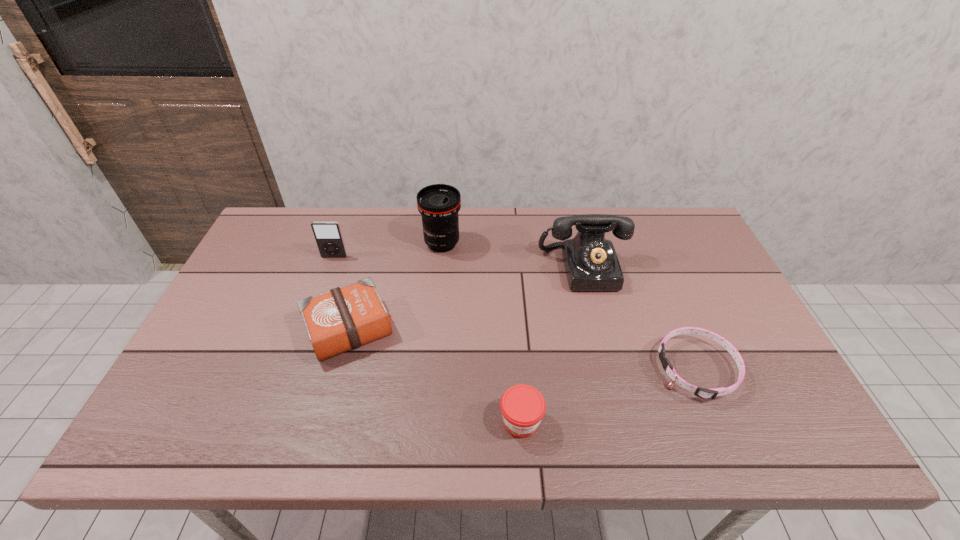
Find the location of a particular element. This screenshot has width=960, height=540. vacant area at the far left corner is located at coordinates (288, 233).

I want to click on free point between the iPod and the shortest object, so click(x=516, y=313).

Where is `blank region between the third object from left to right and the dog collar`? blank region between the third object from left to right and the dog collar is located at coordinates (569, 306).

The width and height of the screenshot is (960, 540). Identify the location of free area in between the fourth object from right to left and the jam. (482, 333).

Identify the location of blank region between the fourth shortest object and the dog collar. The height and width of the screenshot is (540, 960). (516, 313).

This screenshot has height=540, width=960. Identify the location of empty space between the telephone and the dog collar. (640, 319).

Image resolution: width=960 pixels, height=540 pixels. What are the coordinates of `vacant region between the telephone and the third tallest object` in the screenshot? It's located at (459, 262).

You are a GUI agent. You are given a task and a screenshot of the screen. Output one action in this format:
    pyautogui.click(x=<x>, y=<y>)
    Task: Click on the free area in between the telephoto lens and the Bible
    
    Given the screenshot: What is the action you would take?
    pyautogui.click(x=396, y=286)

Where is `vacant area that lies between the jam and the third object from left to right`? This screenshot has width=960, height=540. vacant area that lies between the jam and the third object from left to right is located at coordinates (482, 333).

You are a GUI agent. You are given a task and a screenshot of the screen. Output one action in this format:
    pyautogui.click(x=<x>, y=<y>)
    Task: Click on the free point between the jam and the telephoto lens
    
    Given the screenshot: What is the action you would take?
    pyautogui.click(x=482, y=333)